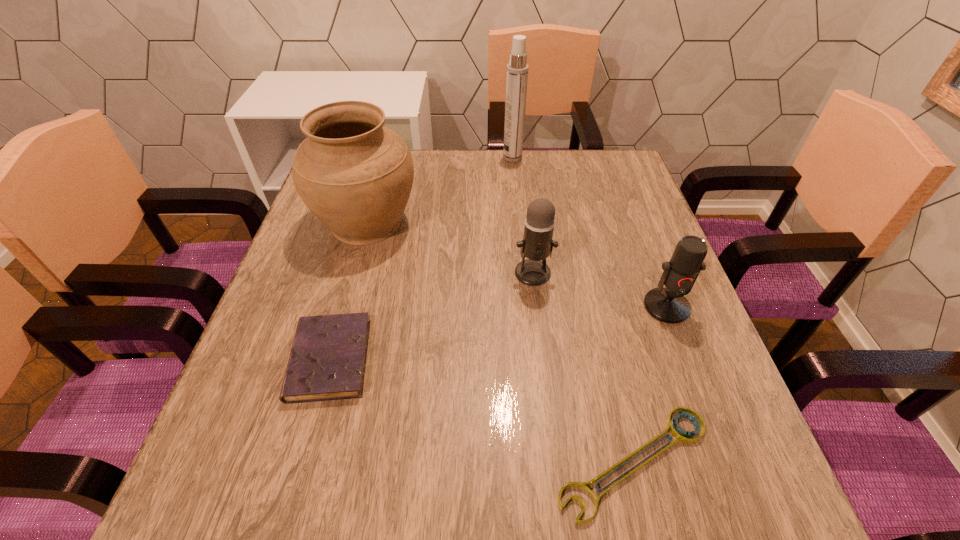
Where is `free location at the far right corner of the desktop`? Image resolution: width=960 pixels, height=540 pixels. free location at the far right corner of the desktop is located at coordinates (594, 180).

I want to click on empty location between the nearest object and the urn, so click(500, 342).

Identify the location of free spot between the second farthest object and the nearest object. (500, 342).

Identify the location of free space between the aerosol can and the diary. (421, 259).

The width and height of the screenshot is (960, 540). I want to click on free spot between the third shortest object and the farthest object, so click(589, 232).

Where is `vacant space that is in between the left microphone and the farthest object`? The image size is (960, 540). vacant space that is in between the left microphone and the farthest object is located at coordinates (523, 215).

This screenshot has width=960, height=540. What are the coordinates of `vacant space that is in between the shortest object and the diary` in the screenshot? It's located at (482, 411).

At what (x,y) coordinates should I click in order to perform the action: click on free space between the wrench and the farther microphone. Please return your answer as a coordinate pair (x, y). Image resolution: width=960 pixels, height=540 pixels. Looking at the image, I should click on (584, 368).

At what (x,y) coordinates should I click in order to perform the action: click on blank region between the wrench and the fifth shortest object. Please return your answer as a coordinate pair (x, y). This screenshot has height=540, width=960. Looking at the image, I should click on (500, 342).

Identify the location of vacant space that's between the shorter microphone and the fourth nearest object. (600, 289).